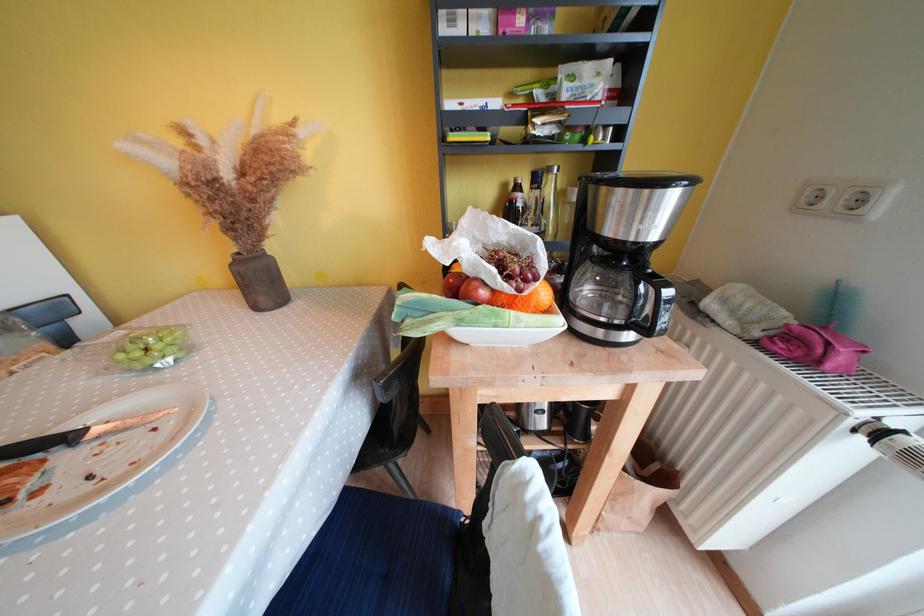
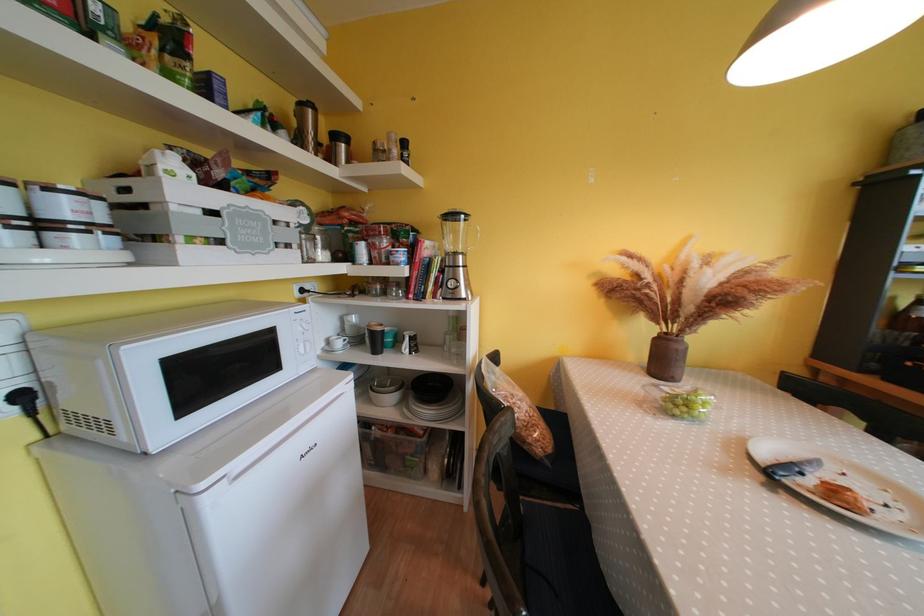
Question: In a continuous first-person perspective shot, in which direction is the camera moving?

Choices:
 (A) Left
 (B) Right
 (C) Forward
 (D) Backward

Answer: (A)